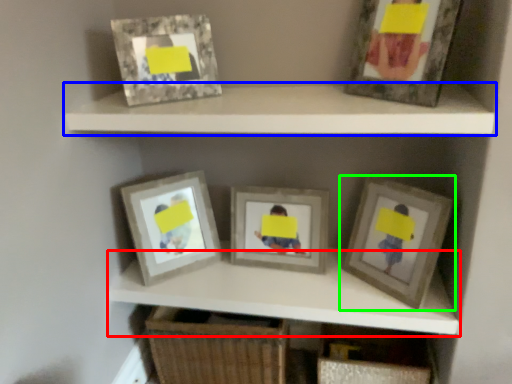
Question: Which object is the closest to the cabinet (highlighted by a red box)? Choose among these: shelf (highlighted by a blue box) or picture frame (highlighted by a green box).

Choices:
 (A) shelf
 (B) picture frame

Answer: (B)